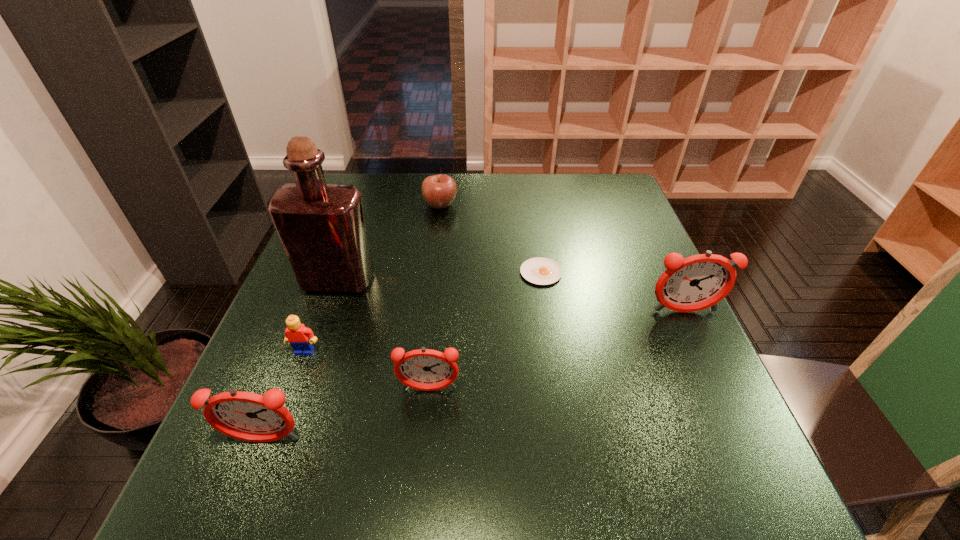
Locate an element on the screen. Image resolution: width=960 pixels, height=540 pixels. egg yolk is located at coordinates (542, 271).

This screenshot has width=960, height=540. What are the coordinates of `the fifth tallest object` in the screenshot? It's located at (301, 338).

Identify the location of Lego. This screenshot has width=960, height=540. (301, 338).

Find the location of a particular element. The height and width of the screenshot is (540, 960). vacant area located on the front-facing side of the shortest alarm clock is located at coordinates click(425, 425).

I want to click on blank space located 0.260m on the front-facing side of the fourth nearest object, so click(736, 424).

The width and height of the screenshot is (960, 540). What are the coordinates of `vacant area located on the side of the apple with the unique marking` in the screenshot? It's located at (569, 204).

Identify the location of free spot located on the back of the liquor. (364, 205).

I want to click on blank space located on the right of the sixth object from left to right, so click(x=645, y=273).

Locate an element on the screen. This screenshot has width=960, height=540. vacant space located 0.110m on the face of the third shortest object is located at coordinates tap(285, 403).

The image size is (960, 540). What are the coordinates of `object that is at the far edge` in the screenshot? It's located at 438,191.